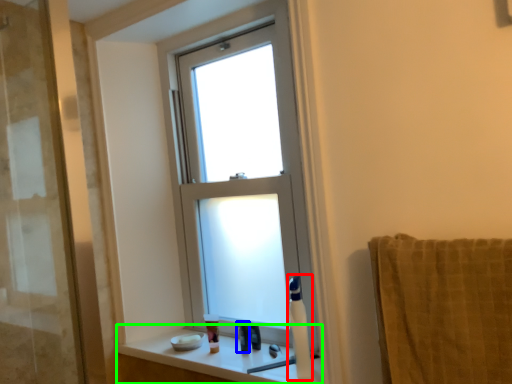
Question: Based on their relative distances, which object is nearer to soap dispenser (highlighted by a red box)? Choose from toiletry (highlighted by a blue box) and window sill (highlighted by a green box).

Choices:
 (A) toiletry
 (B) window sill

Answer: (B)